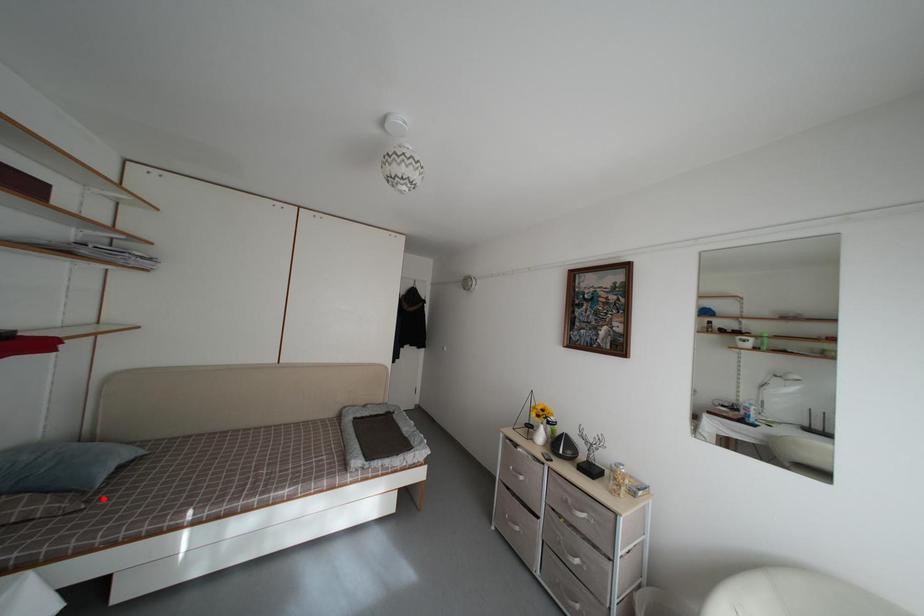
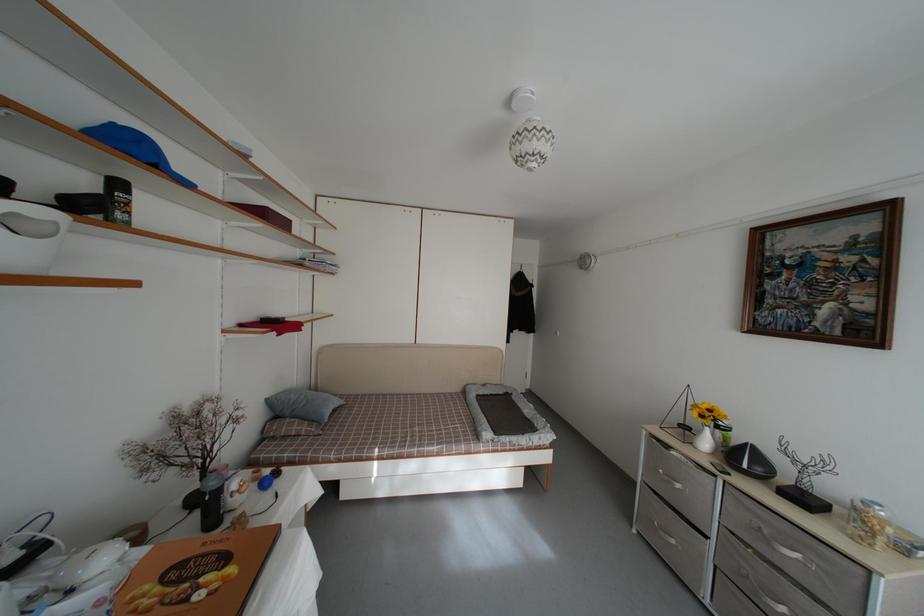
The point at the highlighted location is marked in the first image. Where is the corresponding point in the second image?

(332, 431)